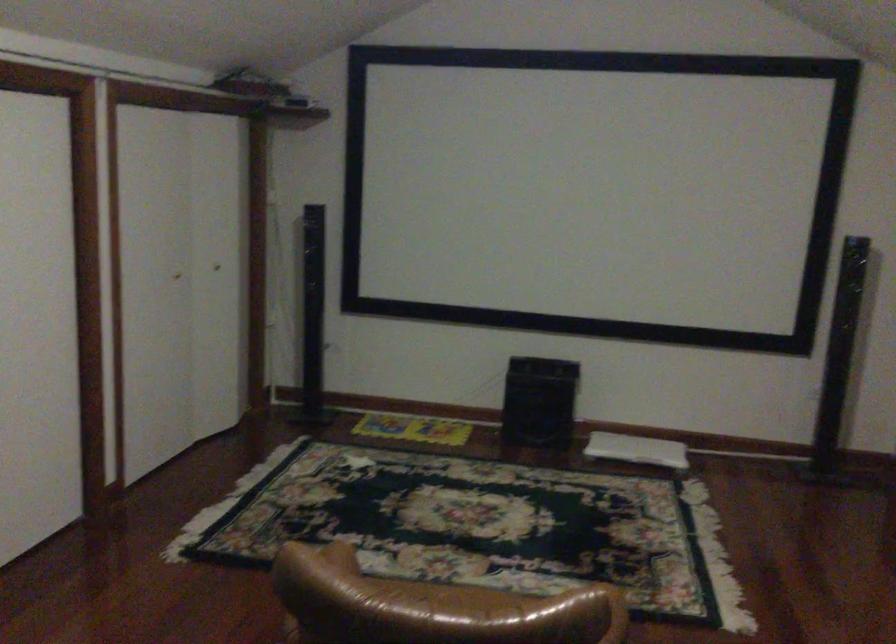
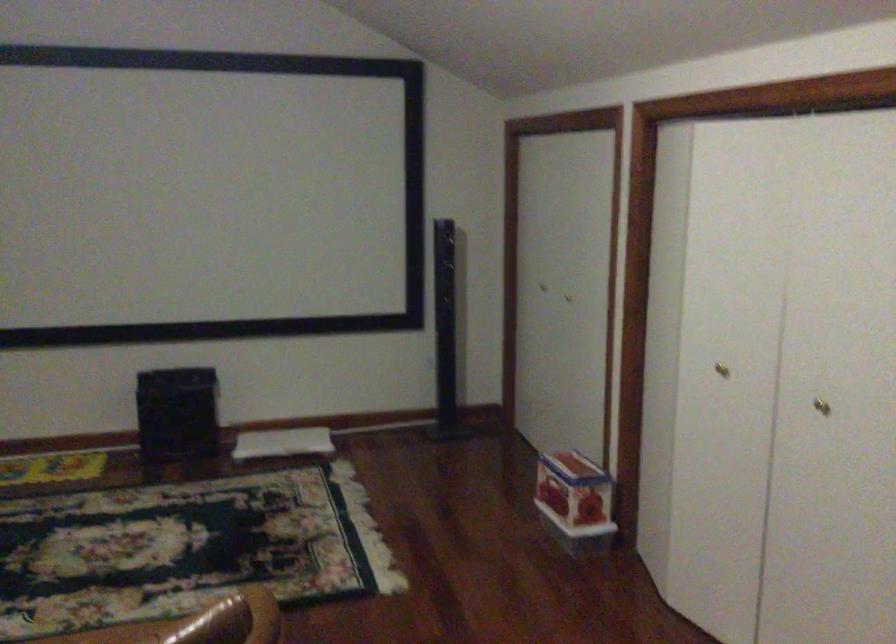
Question: Which direction would the cameraman need to move to produce the second image? Reply with the corresponding letter.

Choices:
 (A) Left
 (B) Right
 (C) Forward
 (D) Backward

Answer: (A)